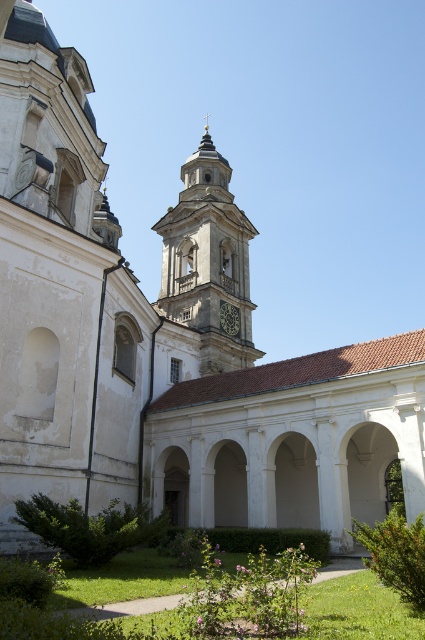
You are standing in the covered walkway looking towards the main building. You notice two objects labeled smooth stone clock tower at center and dark gray stone clock at center. Which of these is positioned higher in the image?

The smooth stone clock tower at center is positioned higher than the dark gray stone clock at center.

You are a maintenance worker needing to reach both the smooth stone clock tower at center and the dark gray stone clock at center. Which one is closer to your current position?

Both the smooth stone clock tower at center and the dark gray stone clock at center are at the same central location, so they are equally close to your current position.